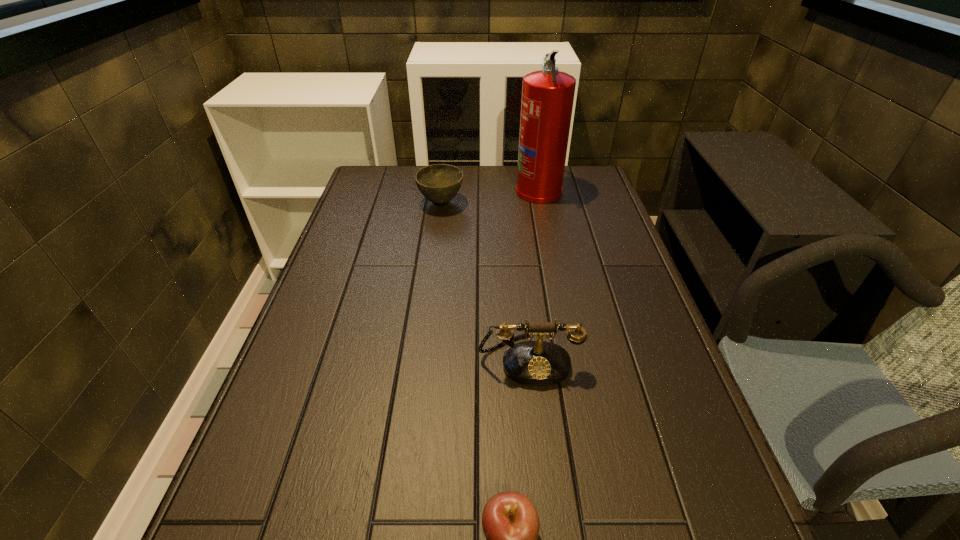
This screenshot has width=960, height=540. Find the location of `fire extinguisher that is positioned at the far edge`. fire extinguisher that is positioned at the far edge is located at coordinates (547, 100).

This screenshot has height=540, width=960. I want to click on bowl that is at the far edge, so (439, 183).

You are a GUI agent. You are given a task and a screenshot of the screen. Output one action in this format:
    pyautogui.click(x=<x>, y=<y>)
    Task: Click on the object at the right edge
    Image resolution: width=960 pixels, height=540 pixels.
    Given the screenshot: What is the action you would take?
    pyautogui.click(x=547, y=100)

The height and width of the screenshot is (540, 960). In order to click on object located in the far right corner section of the desktop in this screenshot , I will do `click(547, 100)`.

Locate an element on the screen. The width and height of the screenshot is (960, 540). vacant space at the far edge is located at coordinates (516, 169).

In the image, there is a desktop. Where is `vacant area at the left edge`? The image size is (960, 540). vacant area at the left edge is located at coordinates pos(297,422).

The image size is (960, 540). I want to click on free region at the right edge of the desktop, so click(602, 204).

Image resolution: width=960 pixels, height=540 pixels. Identify the location of vacant region at the far left corner of the desktop. (356, 193).

Locate an element on the screen. vacant space at the far right corner of the desktop is located at coordinates (595, 184).

Locate an element on the screen. Image resolution: width=960 pixels, height=540 pixels. vacant region between the third shortest object and the tallest object is located at coordinates (534, 274).